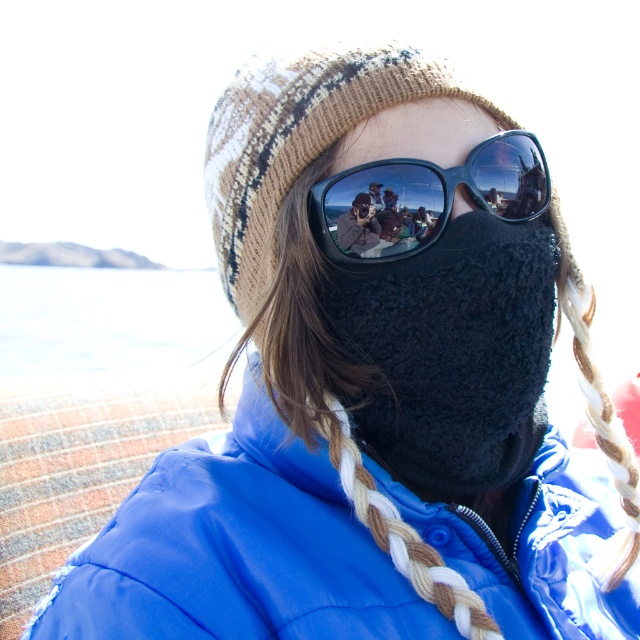
You are a fashion designer observing the person in the image. You need to determine if the blue puffy jacket at center can fit into a storage box designed for the black glossy sunglasses at center. Based on their sizes, what would you conclude?

The blue puffy jacket at center is bigger than the black glossy sunglasses at center, so it cannot fit into the storage box designed for the sunglasses.

You are a fashion designer observing the person in the image. You need to determine the order of layers for their outfit. Which item is placed higher on the body between the blue puffy jacket at center and the black fuzzy mask at center?

The blue puffy jacket at center is in front of the black fuzzy mask at center, so the jacket is placed higher on the body.

You are standing in a cold winter park and see a person wearing a blue puffy jacket at center. If you want to hand them a scarf without moving closer, can you reach them if your arm span is 27 inches?

The blue puffy jacket at center and viewer are 27.28 inches apart from each other. Since your arm span is 27 inches, you cannot reach them as the distance is slightly longer than your reach.